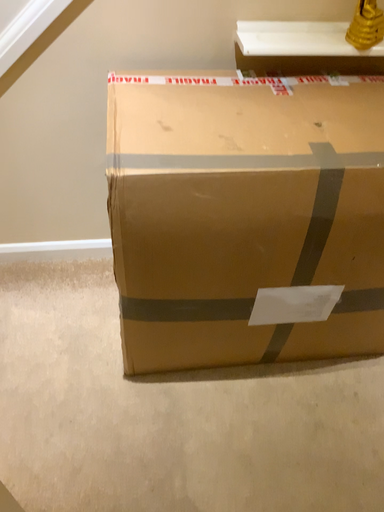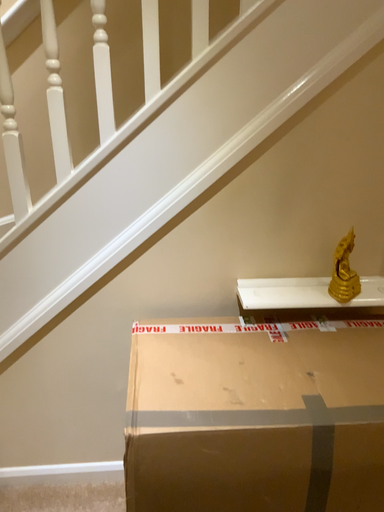
Question: Which way did the camera rotate in the video?

Choices:
 (A) rotated upward
 (B) rotated downward

Answer: (A)